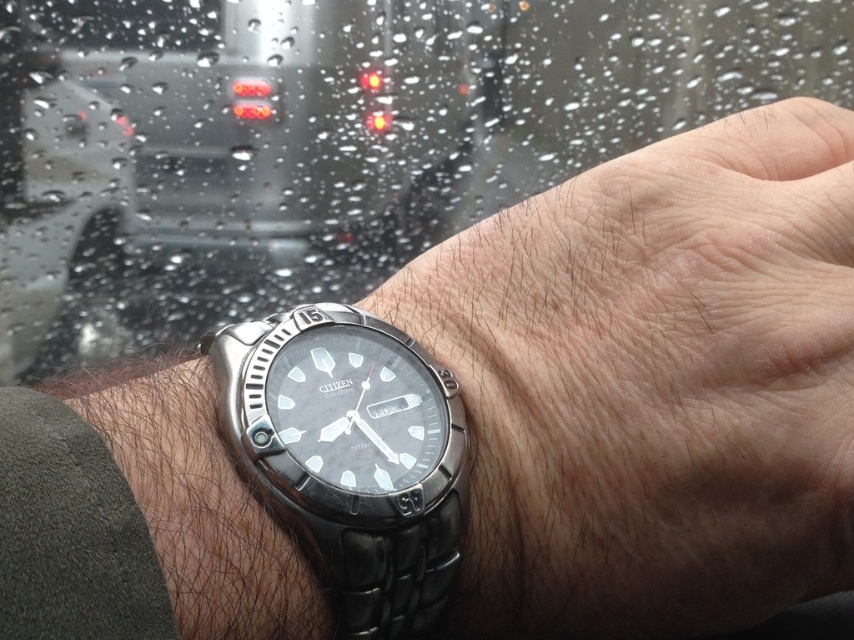
You are a jeweler examining a customer who wants to compare two watches. The customer mentions they want to know which watch is positioned lower between the metallic wristwatch at center and the satin silver watch at lower left. Based on the scene, which one is lower?

The metallic wristwatch at center is positioned below the satin silver watch at lower left, so the metallic wristwatch at center is the lower one.

You are a photographer who wants to ensure the focus of your photo is on the main subject. The main subject is the watch at the center of the image. However, the satin silver watch at lower left is slightly out of focus. Based on the scene description, where should you adjust the focus to capture the main subject clearly?

The main subject is the watch at the center of the image, so you should adjust the focus to the center area where the main watch is located, as the satin silver watch at lower left is positioned at a different point and is slightly out of focus.